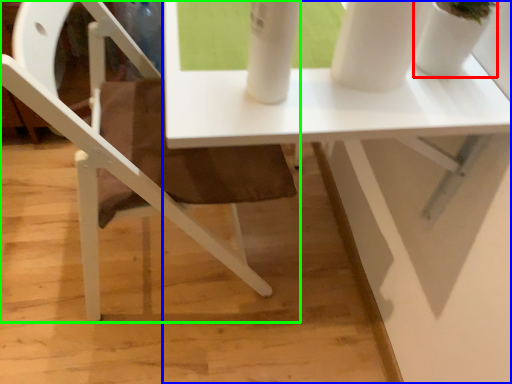
Question: Which object is positioned closest to glass vase (highlighted by a red box)? Select from table (highlighted by a blue box) and chair (highlighted by a green box).

Choices:
 (A) table
 (B) chair

Answer: (A)